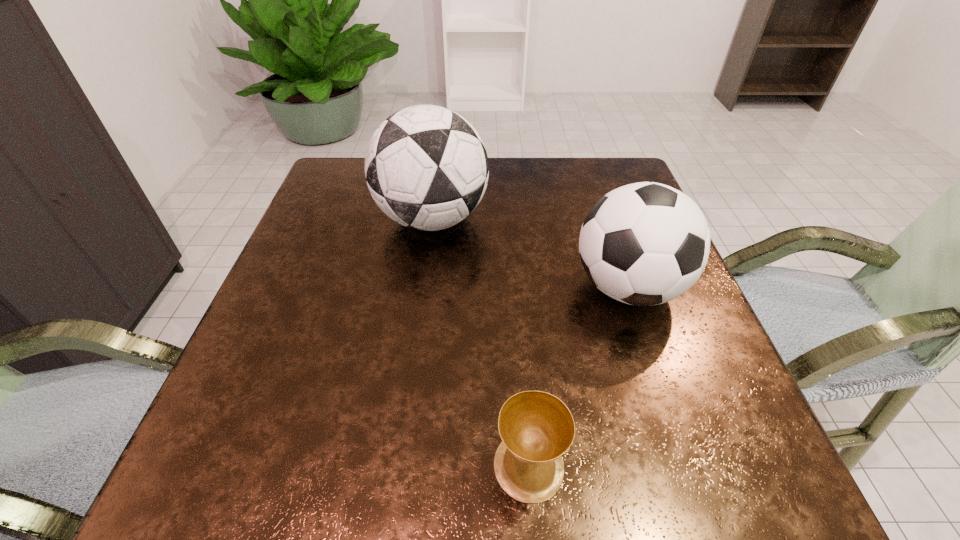
Identify the location of object situated at the near edge. (537, 428).

The image size is (960, 540). I want to click on object present at the right edge, so click(646, 243).

Find the location of a particular element. free space at the far edge is located at coordinates (577, 198).

This screenshot has width=960, height=540. I want to click on free space at the near edge, so click(344, 454).

I want to click on free region at the left edge of the desktop, so click(x=334, y=285).

At what (x,y) coordinates should I click in order to perform the action: click on vacant space at the right edge of the desktop. Please return your answer as a coordinate pair (x, y). The width and height of the screenshot is (960, 540). Looking at the image, I should click on (681, 362).

You are a GUI agent. You are given a task and a screenshot of the screen. Output one action in this format:
    pyautogui.click(x=<x>, y=<y>)
    Task: Click on the blank area at the far left corner
    The image size is (960, 540).
    Given the screenshot: What is the action you would take?
    pyautogui.click(x=348, y=186)

Identify the location of vacant space at the near right corner of the desktop. (670, 460).

Find the location of a particular element. The image size is (960, 540). vacant point located between the second object from left to right and the leftmost object is located at coordinates (481, 342).

You are a GUI agent. You are given a task and a screenshot of the screen. Output one action in this format:
    pyautogui.click(x=<x>, y=<y>)
    Task: Click on the free spot between the right soccer ball and the tallest object
    This screenshot has width=960, height=540.
    Given the screenshot: What is the action you would take?
    (x=530, y=253)